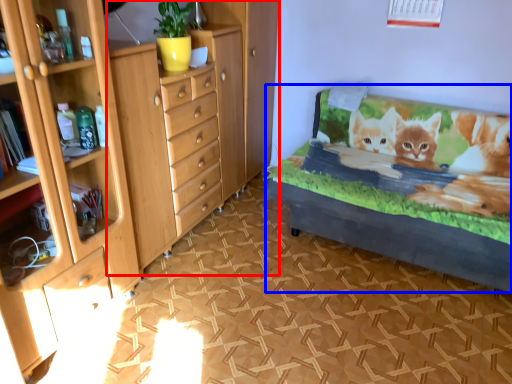
Question: Which object is further to the camera taking this photo, chest of drawers (highlighted by a red box) or bed frame (highlighted by a blue box)?

Choices:
 (A) chest of drawers
 (B) bed frame

Answer: (B)